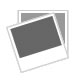
The width and height of the screenshot is (80, 80). Identify the location of tilted picture. (39, 39).